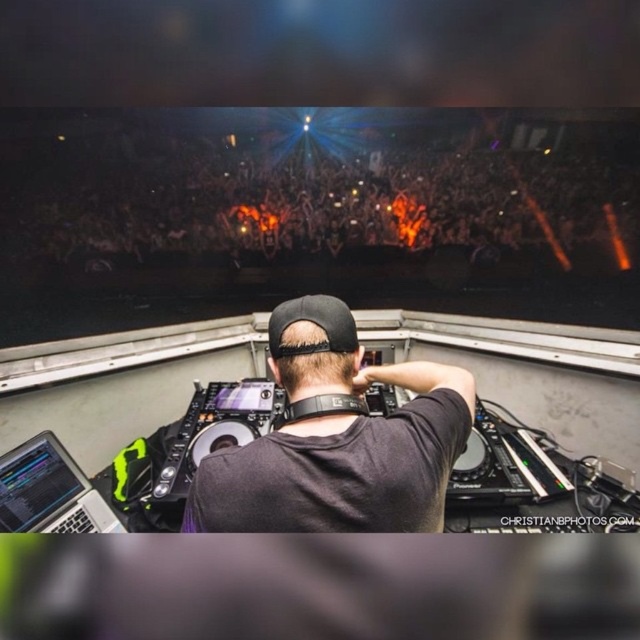
You are a photographer at the concert. You want to take a photo of the DJ without including the crowd. The DJ is at the center. There is a point at coordinates [337,440]. What object is located at this point?

The point at coordinates [337,440] corresponds to the black matte shirt at center, which is part of the DJ.